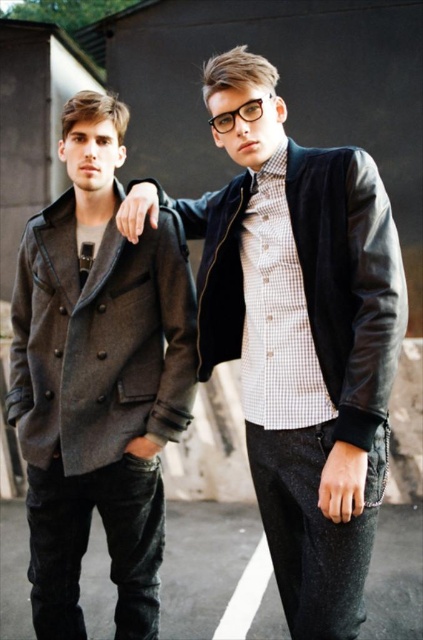
You are a photographer adjusting your camera settings to focus on two points in the image. The first point is at coordinates point (359,243) and the second is at point (176,346). Which point should you focus on first to ensure proper depth of field?

Point (359,243) is closer to the camera than point (176,346), so you should focus on point (359,243) first to ensure proper depth of field.

You are a fashion designer observing two jackets in an urban setting. The jackets are the leather jacket at center and the dark gray woolen jacket at left. Which jacket is positioned to the right of the other?

The leather jacket at center is positioned on the right side of dark gray woolen jacket at left.

You are trying to decide which jacket to wear for a casual evening out. Given that the leather jacket at center is larger than the dark gray woolen jacket at left, which one would you choose if you want a more relaxed and oversized look?

The leather jacket at center is bigger than the dark gray woolen jacket at left, so you should choose the leather jacket at center for a more relaxed and oversized look.